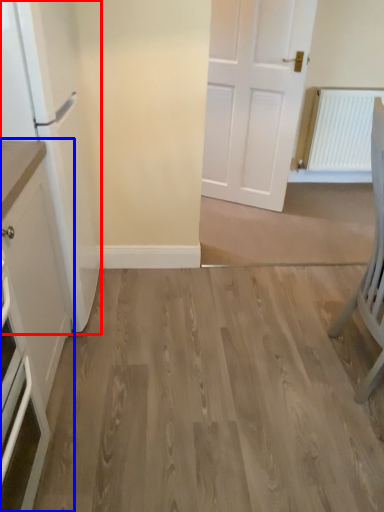
Question: Which object is closer to the camera taking this photo, fridge (highlighted by a red box) or cabinetry (highlighted by a blue box)?

Choices:
 (A) fridge
 (B) cabinetry

Answer: (B)